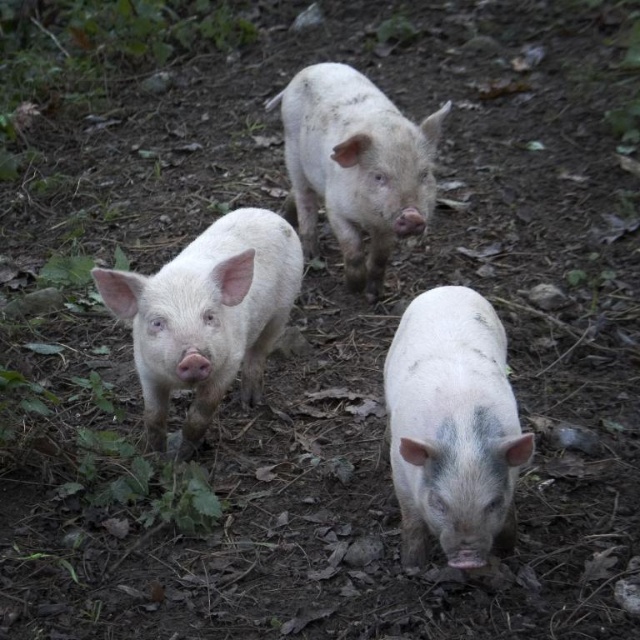
Is point (189, 340) farther from camera compared to point (404, 161)?

No, it is in front of (404, 161).

Can you confirm if smooth pink piglet at center is positioned to the right of white matte pig at center?

Incorrect, smooth pink piglet at center is not on the right side of white matte pig at center.

What do you see at coordinates (208, 314) in the screenshot? I see `smooth pink piglet at center` at bounding box center [208, 314].

Identify the location of smooth pink piglet at center. This screenshot has height=640, width=640. (208, 314).

Is speckled pink piglet at center further to the viewer compared to white matte pig at center?

No, it is in front of white matte pig at center.

Does speckled pink piglet at center have a larger size compared to white matte pig at center?

No, speckled pink piglet at center is not bigger than white matte pig at center.

Who is more forward, (420, 454) or (352, 120)?

Point (420, 454) is in front.

At what (x,y) coordinates should I click in order to perform the action: click on speckled pink piglet at center. Please return your answer as a coordinate pair (x, y). This screenshot has width=640, height=640. Looking at the image, I should click on (452, 428).

Which of these two, speckled pink piglet at center or smooth pink piglet at center, stands shorter?

speckled pink piglet at center is shorter.

Can you confirm if speckled pink piglet at center is wider than smooth pink piglet at center?

No.

I want to click on speckled pink piglet at center, so click(x=452, y=428).